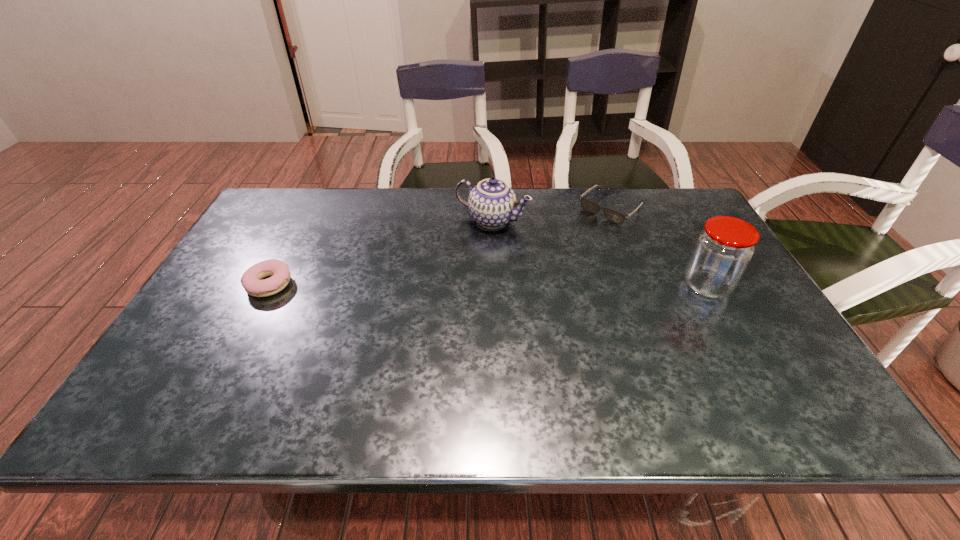
Identify the location of the leftmost object. This screenshot has width=960, height=540. (251, 281).

The image size is (960, 540). In order to click on the rightmost object in this screenshot , I will do (723, 250).

This screenshot has width=960, height=540. In order to click on jar in this screenshot , I will do `click(723, 250)`.

Where is `the third object from left to right`? Image resolution: width=960 pixels, height=540 pixels. the third object from left to right is located at coordinates (614, 216).

Locate an element on the screen. This screenshot has width=960, height=540. the third shortest object is located at coordinates [x=492, y=203].

You are a GUI agent. You are given a task and a screenshot of the screen. Output one action in this format:
    pyautogui.click(x=<x>, y=<y>)
    Task: Click on the chinaware
    Image resolution: width=960 pixels, height=540 pixels.
    Given the screenshot: What is the action you would take?
    pyautogui.click(x=492, y=203)

This screenshot has width=960, height=540. In order to click on free region located on the right of the doughnut in this screenshot , I will do pyautogui.click(x=360, y=285).

Identify the location of vacant space positioned on the back of the tallest object. (677, 232).

In order to click on free space located 0.100m on the front-facing side of the third object from left to right in this screenshot , I will do `click(577, 237)`.

This screenshot has height=540, width=960. I want to click on free spot located 0.130m on the front-facing side of the third object from left to right, so click(572, 241).